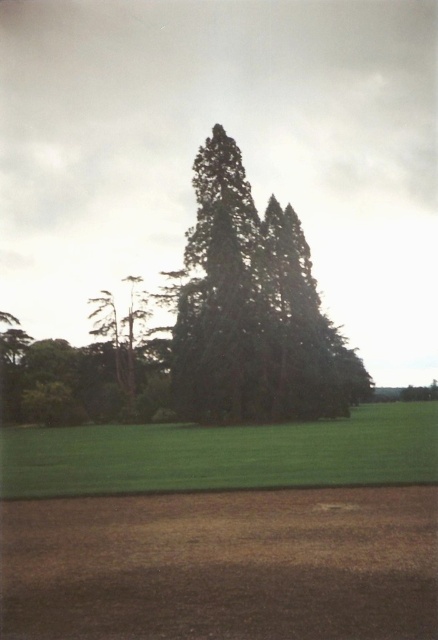
You are a gardener who wants to plant a new flower bed between the brown soil at lower center and the dark green textured tree at center. Considering their heights, which one should you place the flowers closer to?

You should place the flowers closer to the brown soil at lower center because it is shorter than the dark green textured tree at center, so the flowers will have more space to grow without being overshadowed.

You are standing in the scene and want to place a small garden ornament. The ornament requires a stable base. Which location would be more suitable between the brown soil at lower center and the green grass at lower center?

The brown soil at lower center is closer to the viewer than the green grass at lower center, so placing the ornament on the brown soil at lower center would provide a more stable base since it is more accessible and likely firmer.

You are standing in the grassy area and want to plant a small tree. The brown soil at lower center is located at point (222,564). Is this point suitable for planting the tree?

The brown soil at lower center is located at point (222,564), which is in the grassy area. Since the grassy area is well maintained, this point is suitable for planting the small tree.